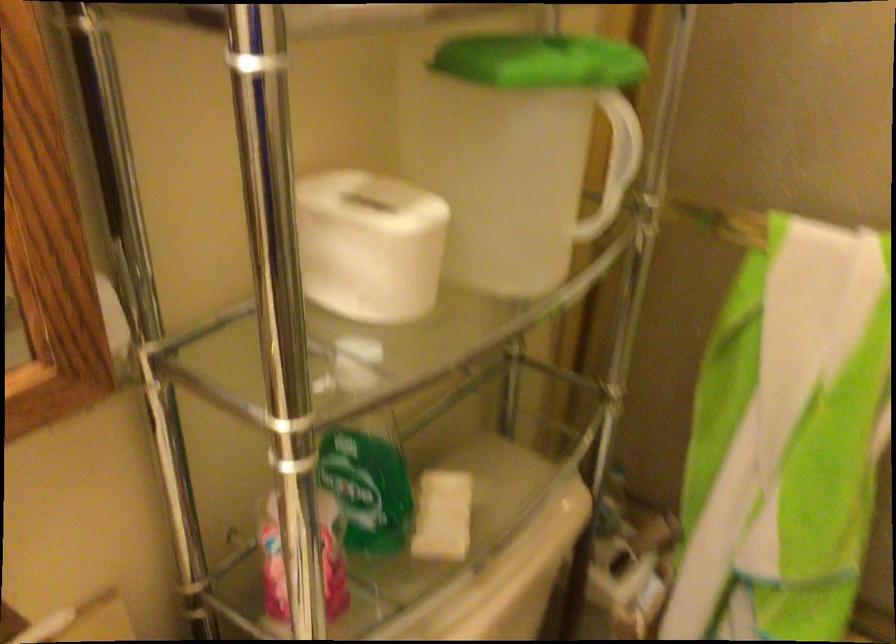
The location [369,245] corresponds to which object?

This point indicates the white tissue dispenser.